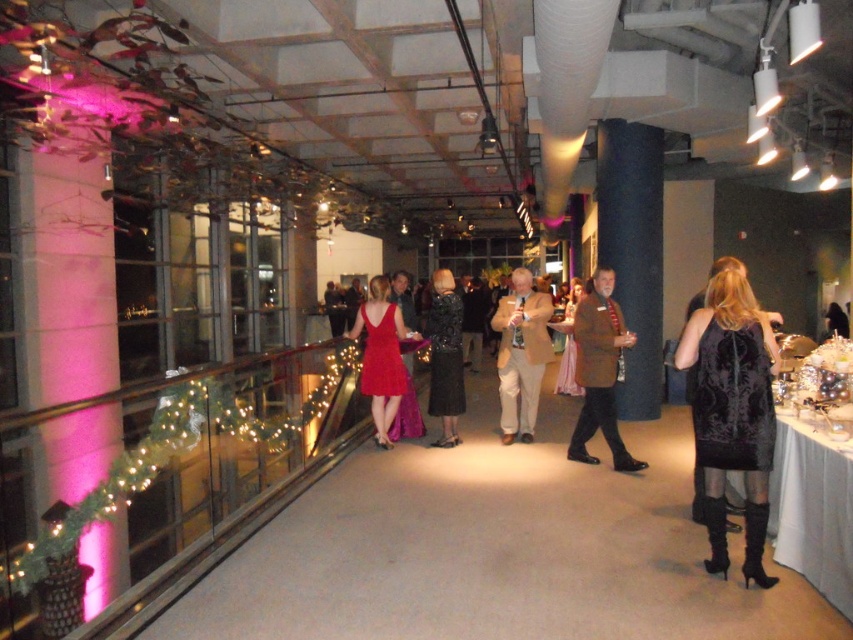
Can you confirm if velvet black dress at right is positioned above tan fabric suit at center?

Correct, velvet black dress at right is located above tan fabric suit at center.

Who is positioned more to the left, velvet black dress at right or tan fabric suit at center?

Positioned to the left is tan fabric suit at center.

The height and width of the screenshot is (640, 853). What are the coordinates of `velvet black dress at right` in the screenshot? It's located at (732, 397).

Is point (737, 388) positioned before point (459, 385)?

Yes, point (737, 388) is in front of point (459, 385).

Is velvet black dress at right below black satin dress at center?

Yes.

What are the coordinates of `velvet black dress at right` in the screenshot? It's located at (732, 397).

Does point (746, 323) lie in front of point (569, 292)?

Yes, it is.

Locate an element on the screen. This screenshot has height=640, width=853. black velvet dress at right is located at coordinates (732, 412).